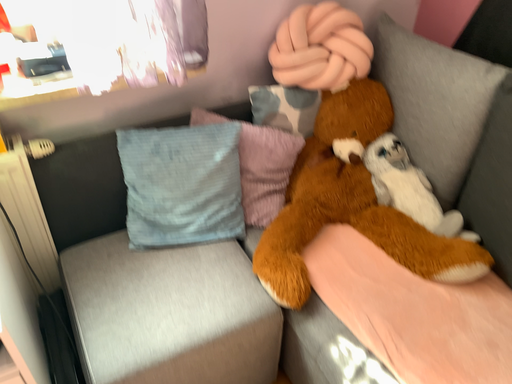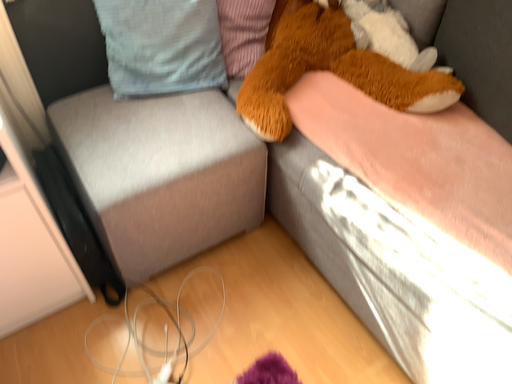
Question: Which way did the camera rotate in the video?

Choices:
 (A) rotated upward
 (B) rotated downward

Answer: (B)